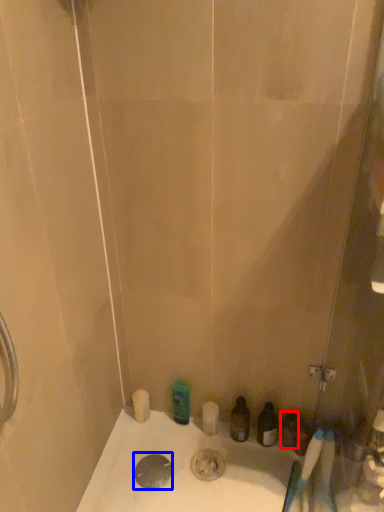
Question: Which of the following is the closest to the observer, toiletry (highlighted by a red box) or drain (highlighted by a blue box)?

Choices:
 (A) toiletry
 (B) drain

Answer: (B)